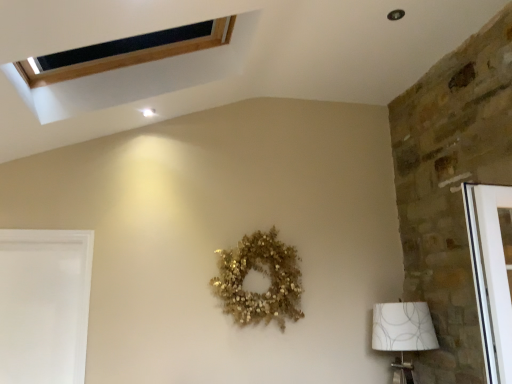
Question: Considering the positions of white fabric lampshade at lower right and white matte screen door at lower left in the image, is white fabric lampshade at lower right taller or shorter than white matte screen door at lower left?

Choices:
 (A) tall
 (B) short

Answer: (B)

Question: In the image, is white fabric lampshade at lower right on the left side or the right side of white matte screen door at lower left?

Choices:
 (A) left
 (B) right

Answer: (B)

Question: Considering the positions of white fabric lampshade at lower right and white matte screen door at lower left in the image, is white fabric lampshade at lower right bigger or smaller than white matte screen door at lower left?

Choices:
 (A) big
 (B) small

Answer: (A)

Question: Is white matte screen door at lower left to the left or to the right of white fabric lampshade at lower right in the image?

Choices:
 (A) right
 (B) left

Answer: (B)

Question: Is white matte screen door at lower left taller or shorter than white fabric lampshade at lower right?

Choices:
 (A) tall
 (B) short

Answer: (A)

Question: From the image's perspective, is white matte screen door at lower left above or below white fabric lampshade at lower right?

Choices:
 (A) below
 (B) above

Answer: (B)

Question: Looking at the image, does white matte screen door at lower left seem bigger or smaller compared to white fabric lampshade at lower right?

Choices:
 (A) small
 (B) big

Answer: (A)